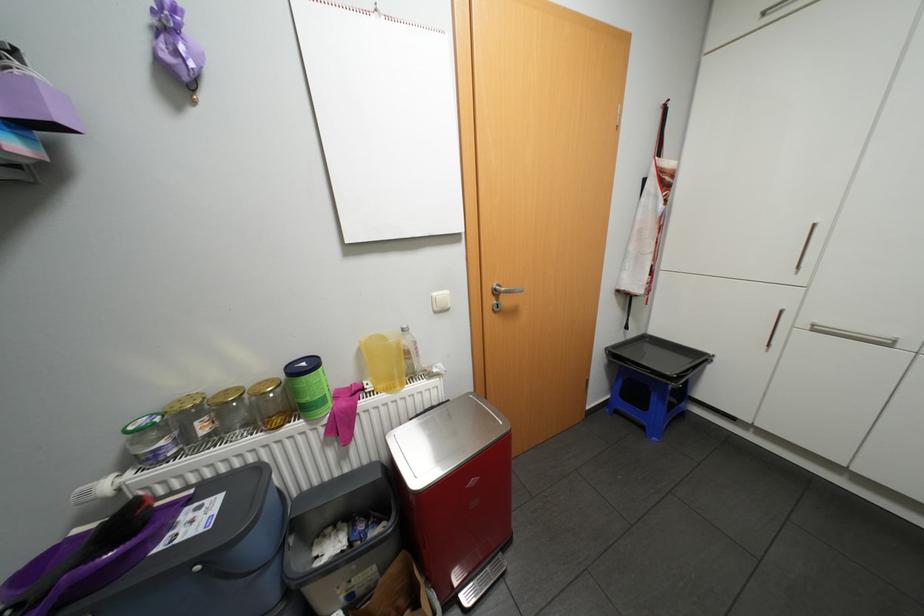
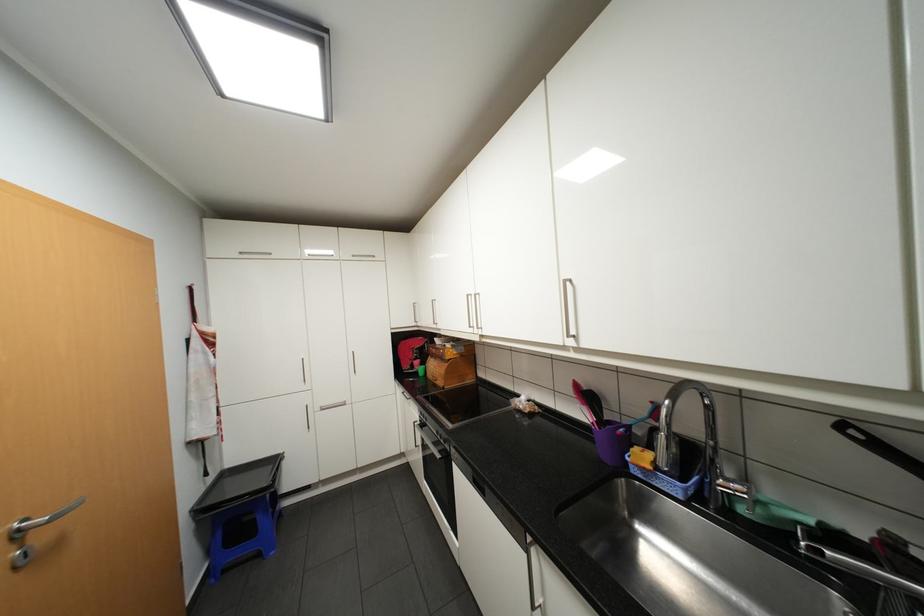
The point at (x=504, y=289) is marked in the first image. Where is the corresponding point in the second image?

(27, 530)